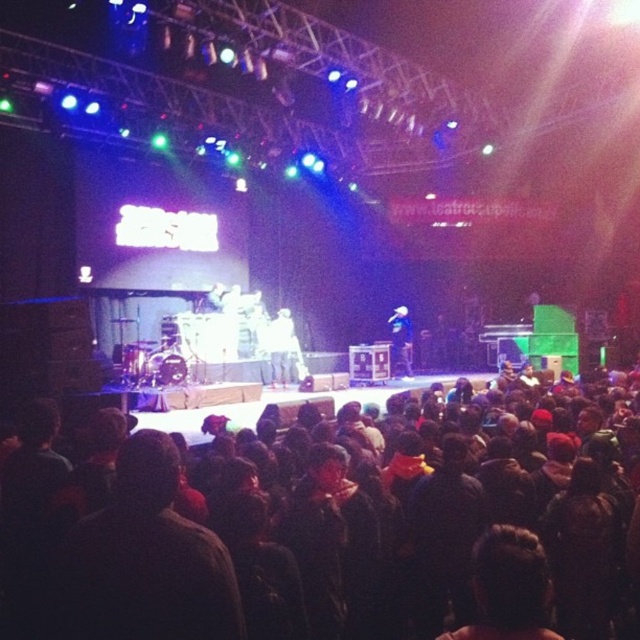
Question: Is dark brown hair at center closer to the viewer compared to shiny blue jacket at center?

Choices:
 (A) no
 (B) yes

Answer: (B)

Question: Is dark fabric crowd at center bigger than shiny blue jacket at center?

Choices:
 (A) yes
 (B) no

Answer: (A)

Question: Which point is farther to the camera?

Choices:
 (A) (227, 620)
 (B) (394, 360)
 (C) (90, 570)

Answer: (B)

Question: Where is dark fabric crowd at center located in relation to shiny blue jacket at center in the image?

Choices:
 (A) left
 (B) right

Answer: (A)

Question: Which of these objects is positioned closest to the shiny blue jacket at center?

Choices:
 (A) dark brown hair at center
 (B) dark fabric crowd at center

Answer: (B)

Question: Which object appears farthest from the camera in this image?

Choices:
 (A) dark brown hair at center
 (B) dark fabric crowd at center

Answer: (B)